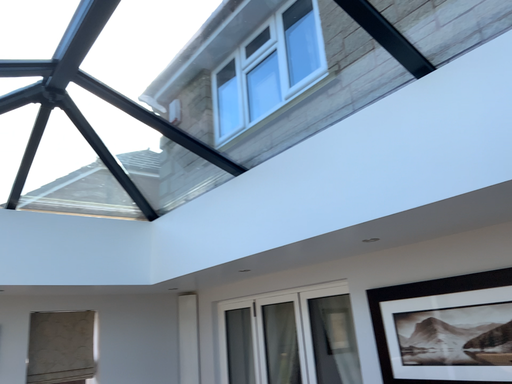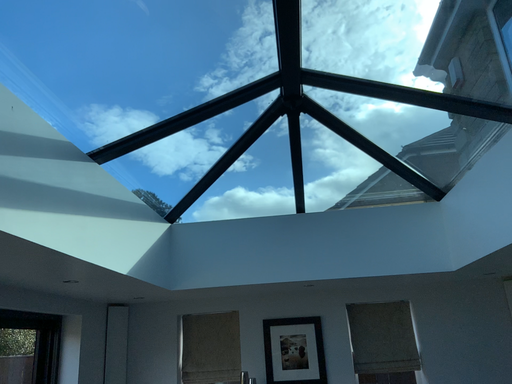
Question: Which way did the camera rotate in the video?

Choices:
 (A) rotated upward
 (B) rotated downward

Answer: (B)